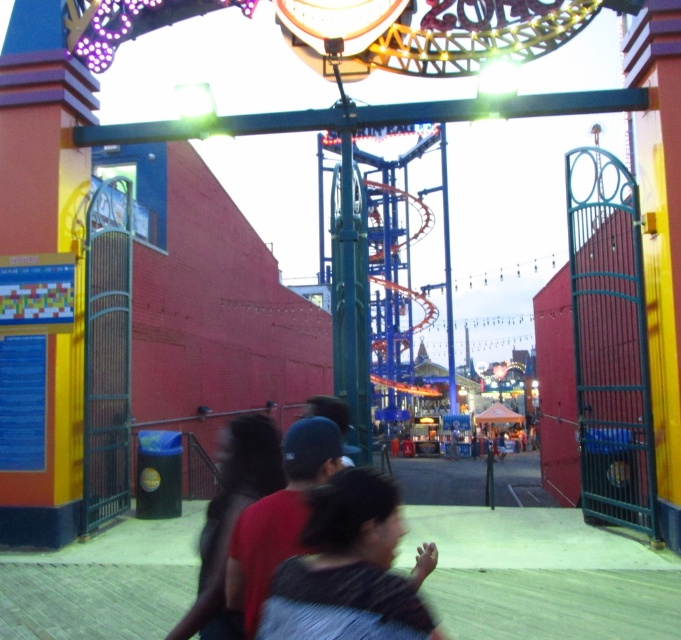
From the picture: You are a photographer trying to capture a clear shot of the entrance of the roller coaster. You notice two people in the foreground, one with blurred dark hair at center and another wearing a dark gray fabric shirt at center. Which of these two people is closer to the camera?

The blurred dark hair at center is closer to the camera than the dark gray fabric shirt at center because it occupies less space.

You are observing a group of people walking towards the roller coaster entrance. There is a person with blurred dark hair at center and a person wearing a dark gray fabric shirt at center. Which of these two people is closer to the roller coaster entrance?

The blurred dark hair at center is closer to the roller coaster entrance because it is in front of the dark gray fabric shirt at center.